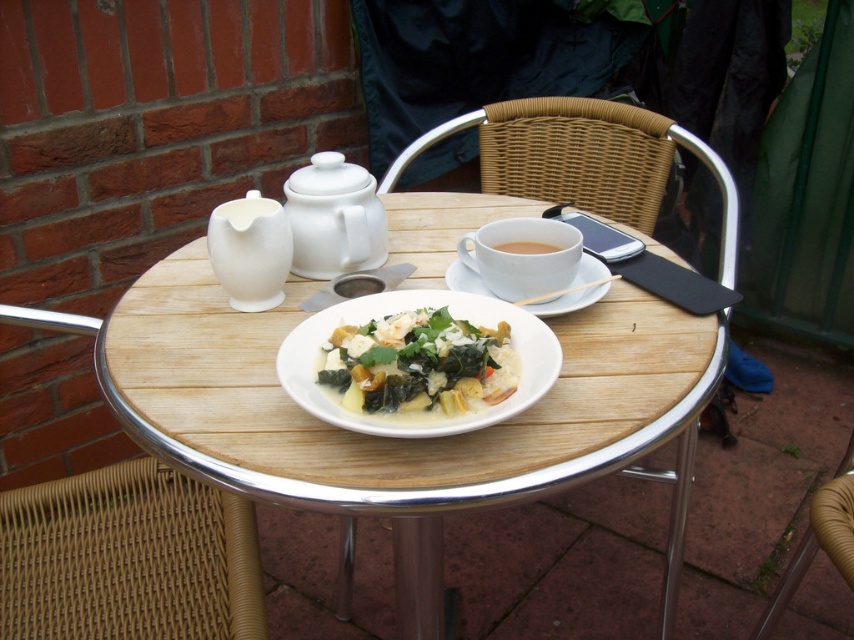
Question: Estimate the real-world distances between objects in this image. Which object is closer to the white matte cup at center?

Choices:
 (A) white glossy teapot at upper left
 (B) woven wicker chair at center
 (C) creamy white sauce at center
 (D) wooden table at center

Answer: (C)

Question: Is wooden table at center wider than creamy white sauce at center?

Choices:
 (A) yes
 (B) no

Answer: (A)

Question: Can you confirm if woven wicker chair at center is smaller than white matte cup at center?

Choices:
 (A) yes
 (B) no

Answer: (B)

Question: Which of these objects is positioned farthest from the wooden table at center?

Choices:
 (A) white ceramic cup at center
 (B) white ceramic teapot at upper center
 (C) woven wicker chair at lower left

Answer: (C)

Question: Which object is the closest to the white ceramic saucer at center?

Choices:
 (A) white ceramic cup at center
 (B) creamy white sauce at center
 (C) wooden table at center
 (D) woven wicker chair at lower left

Answer: (A)

Question: Is woven wicker chair at center bigger than white ceramic saucer at center?

Choices:
 (A) no
 (B) yes

Answer: (B)